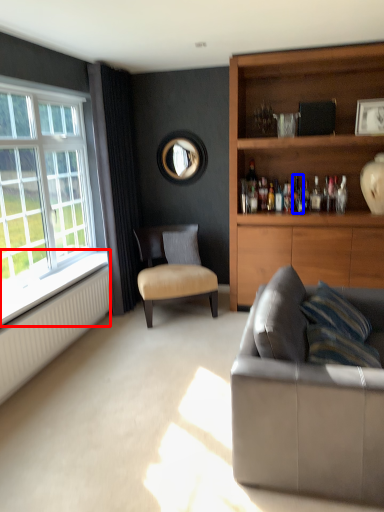
Question: Which point is further to the camera, window sill (highlighted by a red box) or bottle (highlighted by a blue box)?

Choices:
 (A) window sill
 (B) bottle

Answer: (B)